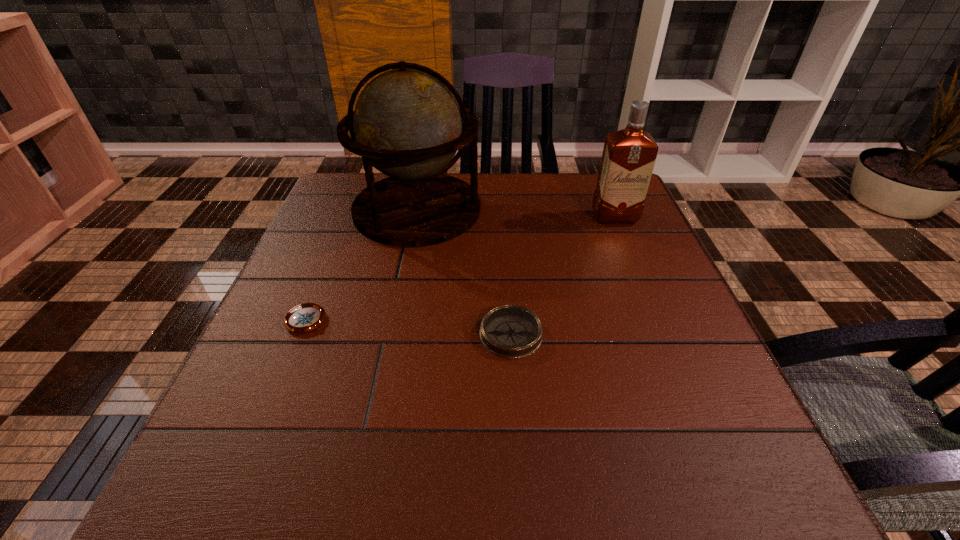
The width and height of the screenshot is (960, 540). I want to click on globe, so click(407, 124).

Where is `the third shortest object`? the third shortest object is located at coordinates (629, 155).

This screenshot has height=540, width=960. What are the coordinates of `liquor` in the screenshot? It's located at (629, 155).

This screenshot has height=540, width=960. What are the coordinates of `the taller compass` in the screenshot? It's located at (510, 331).

This screenshot has height=540, width=960. In order to click on the second shortest object in this screenshot , I will do `click(510, 331)`.

Identify the location of the shorter compass. The image size is (960, 540). (306, 317).

At what (x,y) coordinates should I click in order to perform the action: click on the left compass. Please return your answer as a coordinate pair (x, y). Looking at the image, I should click on (306, 317).

This screenshot has width=960, height=540. I want to click on free space located on the front-facing side of the tallest object, so click(539, 210).

Where is `free point located on the front label of the second tallest object`? Image resolution: width=960 pixels, height=540 pixels. free point located on the front label of the second tallest object is located at coordinates (626, 245).

At what (x,y) coordinates should I click in order to perform the action: click on vacant space located on the left of the right compass. Please return your answer as a coordinate pair (x, y). Image resolution: width=960 pixels, height=540 pixels. Looking at the image, I should click on (369, 334).